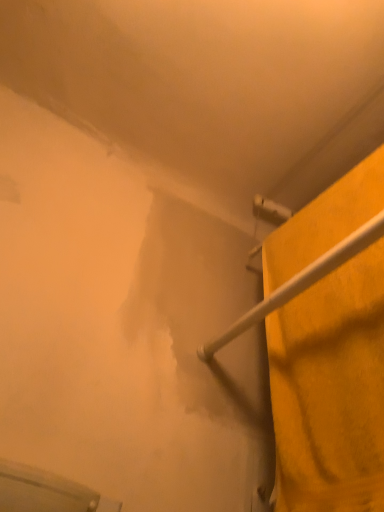
Question: Should I look upward or downward to see yellow fabric towel at right?

Choices:
 (A) down
 (B) up

Answer: (A)